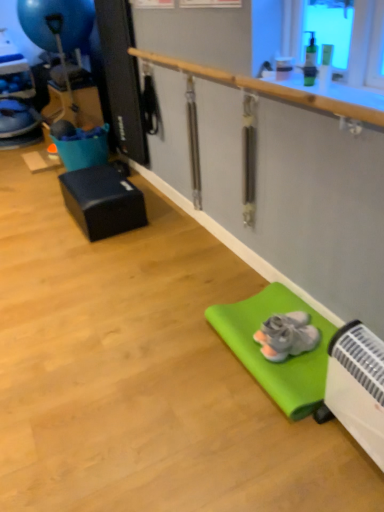
Where is `free space on the front side of green rubber yoga mat at lower right`? Image resolution: width=384 pixels, height=512 pixels. free space on the front side of green rubber yoga mat at lower right is located at coordinates (260, 453).